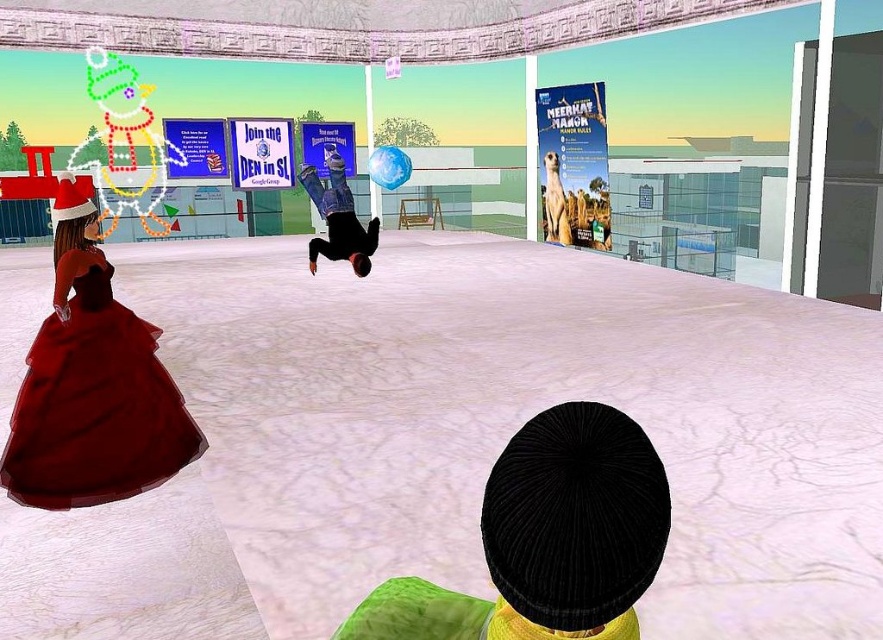
Can you confirm if velvet red dress at lower left is smaller than black matte person at center?

Yes.

Does point (136, 413) come closer to viewer compared to point (315, 243)?

Yes, it is.

Find the location of a particular element. This screenshot has width=883, height=640. velvet red dress at lower left is located at coordinates (95, 406).

Looking at this image, is black corduroy hat at center to the left of black matte person at center from the viewer's perspective?

No, black corduroy hat at center is not to the left of black matte person at center.

Does point (489, 476) come closer to viewer compared to point (340, 244)?

Yes, point (489, 476) is closer to viewer.

Which is behind, point (595, 493) or point (336, 244)?

The point (336, 244) is more distant.

The height and width of the screenshot is (640, 883). In order to click on black corduroy hat at center in this screenshot , I will do `click(547, 540)`.

Does point (497, 586) come in front of point (69, 365)?

Yes, point (497, 586) is closer to viewer.

Is black corduroy hat at center above velvet red dress at lower left?

Actually, black corduroy hat at center is below velvet red dress at lower left.

Which is behind, point (570, 600) or point (84, 280)?

The point (84, 280) is behind.

This screenshot has width=883, height=640. I want to click on black corduroy hat at center, so click(x=547, y=540).